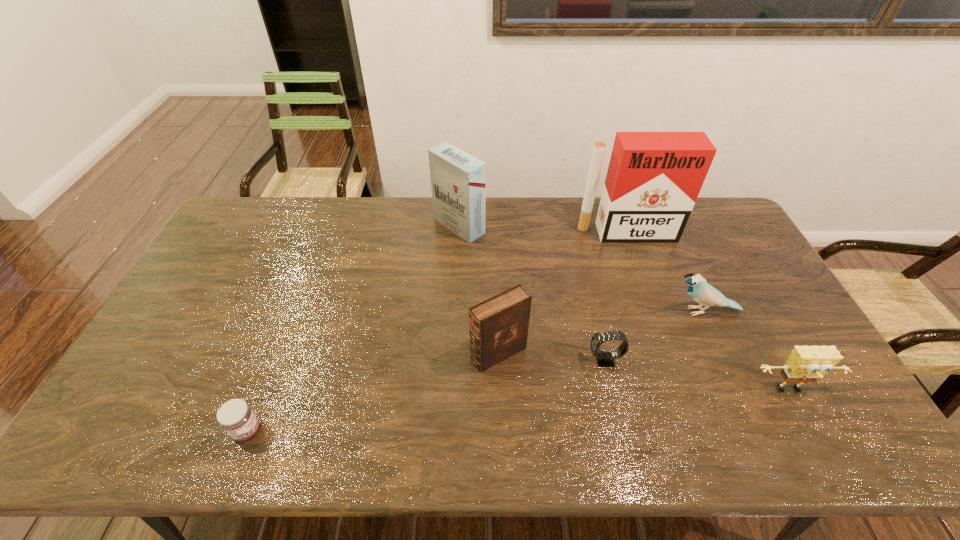
Identify the location of vacant space that satisfies the following two spatial constraints: 1. on the front-facing side of the right cigarette case; 2. on the front label of the shortest object. This screenshot has width=960, height=540. (697, 430).